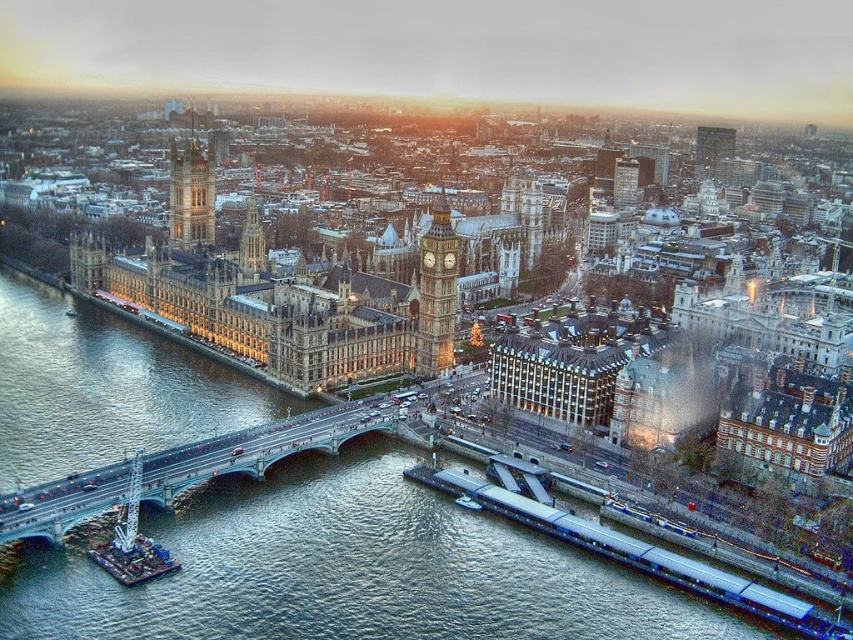
Does green metallic bridge at lower left have a lesser width compared to golden stone clock tower at upper left?

Correct, green metallic bridge at lower left's width is less than golden stone clock tower at upper left's.

Does point (152, 483) come behind point (183, 177)?

No, it is in front of (183, 177).

Measure the distance between point (329,451) and camera.

Point (329,451) is 138.22 meters away from camera.

Image resolution: width=853 pixels, height=640 pixels. What are the coordinates of `green metallic bridge at lower left` in the screenshot? It's located at tap(259, 448).

Which is behind, point (13, 532) or point (425, 257)?

The point (425, 257) is more distant.

Who is lower down, green metallic bridge at lower left or golden stone clock tower at center?

green metallic bridge at lower left

The height and width of the screenshot is (640, 853). What do you see at coordinates (259, 448) in the screenshot? I see `green metallic bridge at lower left` at bounding box center [259, 448].

Locate an element on the screen. The height and width of the screenshot is (640, 853). green metallic bridge at lower left is located at coordinates (259, 448).

Between golden stone clock tower at center and golden stone clock tower at upper left, which one appears on the left side from the viewer's perspective?

From the viewer's perspective, golden stone clock tower at upper left appears more on the left side.

Between point (421, 339) and point (195, 208), which one is positioned in front?

Positioned in front is point (421, 339).

You are a GUI agent. You are given a task and a screenshot of the screen. Output one action in this format:
    pyautogui.click(x=<x>, y=<y>)
    Task: Click on the golden stone clock tower at center
    This screenshot has width=853, height=640.
    Given the screenshot: What is the action you would take?
    pyautogui.click(x=436, y=292)